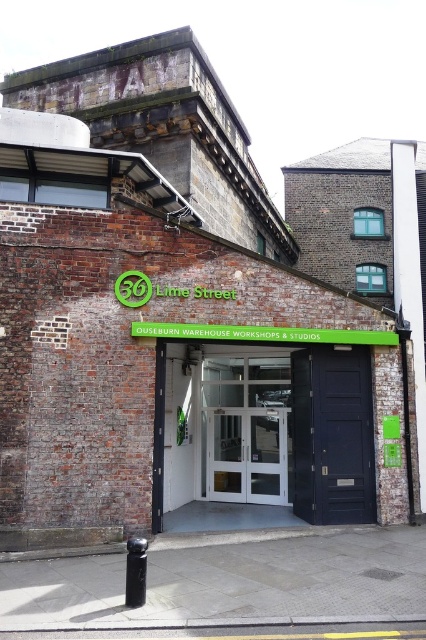
Between white glass door at center and black polished metal pole at lower center, which one is positioned higher?

white glass door at center is higher up.

Locate an element on the screen. white glass door at center is located at coordinates (287, 432).